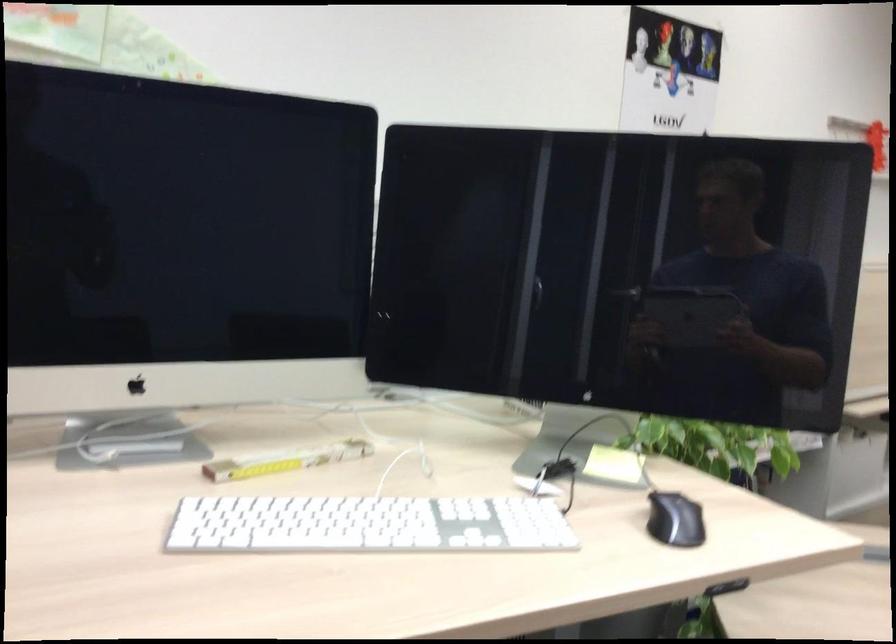
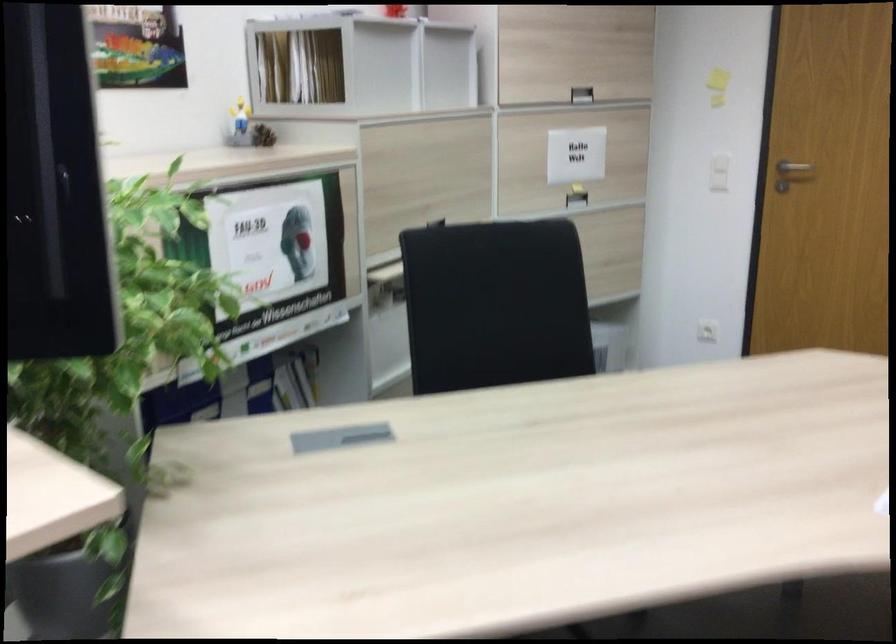
Question: Which direction would the cameraman need to move to produce the second image? Reply with the corresponding letter.

Choices:
 (A) Left
 (B) Right
 (C) Forward
 (D) Backward

Answer: (B)